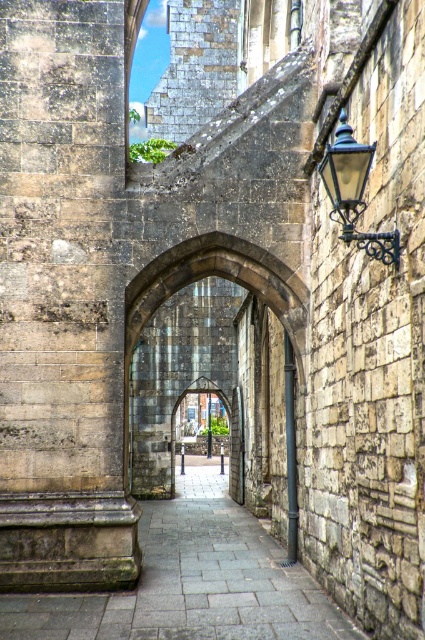
Who is lower down, stone archway at center or black wrought iron lamp at upper right?

stone archway at center is below.

Is stone archway at center further to the viewer compared to black wrought iron lamp at upper right?

Yes, it is.

Is point (291, 461) positioned behind point (343, 112)?

That is True.

Image resolution: width=425 pixels, height=640 pixels. In order to click on stone archway at center in this screenshot , I will do `click(201, 365)`.

The image size is (425, 640). In order to click on gray stone pillar at left in this screenshot , I will do `click(62, 298)`.

Is gray stone pillar at left to the right of black wrought iron lamp at upper right from the viewer's perspective?

In fact, gray stone pillar at left is to the left of black wrought iron lamp at upper right.

Which is behind, point (59, 163) or point (393, 237)?

The point (59, 163) is behind.

This screenshot has width=425, height=640. I want to click on gray stone pillar at left, so click(x=62, y=298).

Is point (57, 627) closer to camera compared to point (223, 308)?

Yes, it is.

Is gray stone path at center positioned behind stone archway at center?

That is False.

This screenshot has width=425, height=640. What do you see at coordinates (192, 580) in the screenshot?
I see `gray stone path at center` at bounding box center [192, 580].

I want to click on gray stone path at center, so click(x=192, y=580).